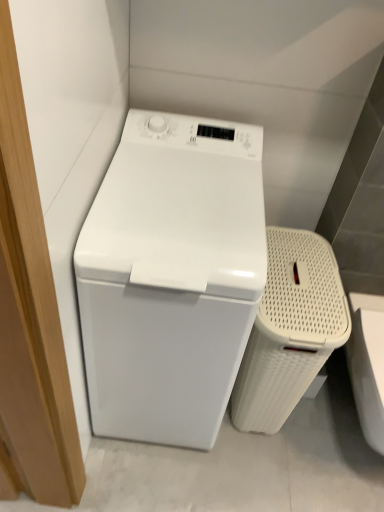
What is the approximate width of white woven laundry basket at right?

white woven laundry basket at right is 17.74 inches wide.

This screenshot has height=512, width=384. Describe the element at coordinates (290, 330) in the screenshot. I see `white woven laundry basket at right` at that location.

Where is `white woven laundry basket at right`? This screenshot has height=512, width=384. white woven laundry basket at right is located at coordinates (290, 330).

In the scene shown: Measure the distance between point [127,204] and camera.

Point [127,204] is 37.40 inches away from camera.

Describe the element at coordinates (171, 277) in the screenshot. I see `white glossy washing machine at left` at that location.

At what (x,y) coordinates should I click in order to perform the action: click on white glossy washing machine at left. Please return your answer as a coordinate pair (x, y). Looking at the image, I should click on click(x=171, y=277).

Identify the location of white woven laundry basket at right. The image size is (384, 512). (290, 330).

Would you say white woven laundry basket at right is to the left or to the right of white glossy washing machine at left in the picture?

Based on their positions, white woven laundry basket at right is located to the right of white glossy washing machine at left.

Between white woven laundry basket at right and white glossy washing machine at left, which one is positioned behind?

Positioned behind is white woven laundry basket at right.

Is point (276, 251) in front of point (99, 349)?

No, it is behind (99, 349).

Consider the image. From the image's perspective, which one is positioned higher, white woven laundry basket at right or white glossy washing machine at left?

white glossy washing machine at left.

From a real-world perspective, is white woven laundry basket at right above or below white glossy washing machine at left?

white woven laundry basket at right is situated lower than white glossy washing machine at left in the real world.

Which object is thinner, white woven laundry basket at right or white glossy washing machine at left?

white woven laundry basket at right is thinner.

Is white woven laundry basket at right taller than white glossy washing machine at left?

In fact, white woven laundry basket at right may be shorter than white glossy washing machine at left.

Can you confirm if white woven laundry basket at right is bigger than white glossy washing machine at left?

Incorrect, white woven laundry basket at right is not larger than white glossy washing machine at left.

Does white woven laundry basket at right contain white glossy washing machine at left?

No, white glossy washing machine at left is not a part of white woven laundry basket at right.

Is white woven laundry basket at right not near white glossy washing machine at left?

No.

Could you tell me if white woven laundry basket at right is facing white glossy washing machine at left?

No, white woven laundry basket at right is not aimed at white glossy washing machine at left.

The height and width of the screenshot is (512, 384). I want to click on washing machine that appears above the white woven laundry basket at right (from a real-world perspective), so click(x=171, y=277).

Is white glossy washing machine at left at the left side of white woven laundry basket at right?

Yes.

Considering the relative positions of white glossy washing machine at left and white woven laundry basket at right in the image provided, is white glossy washing machine at left behind white woven laundry basket at right?

No, white glossy washing machine at left is in front of white woven laundry basket at right.

Does point (150, 345) lie behind point (295, 241)?

No.

From the image's perspective, is white glossy washing machine at left located above or below white woven laundry basket at right?

Clearly, from the image's perspective, white glossy washing machine at left is above white woven laundry basket at right.

From a real-world perspective, who is located higher, white glossy washing machine at left or white woven laundry basket at right?

From a 3D spatial view, white glossy washing machine at left is above.

Is white glossy washing machine at left thinner than white woven laundry basket at right?

Incorrect, the width of white glossy washing machine at left is not less than that of white woven laundry basket at right.

Considering the relative sizes of white glossy washing machine at left and white woven laundry basket at right in the image provided, is white glossy washing machine at left shorter than white woven laundry basket at right?

In fact, white glossy washing machine at left may be taller than white woven laundry basket at right.

Between white glossy washing machine at left and white woven laundry basket at right, which one has larger size?

white glossy washing machine at left.

Can we say white glossy washing machine at left lies outside white woven laundry basket at right?

Indeed, white glossy washing machine at left is completely outside white woven laundry basket at right.

Are white glossy washing machine at left and white woven laundry basket at right making contact?

No.

Is white glossy washing machine at left facing towards white woven laundry basket at right?

No.

In the image, there is a white glossy washing machine at left. Identify the location of laundry basket below it (from the image's perspective). The width and height of the screenshot is (384, 512). (290, 330).

At what (x,y) coordinates should I click in order to perform the action: click on laundry basket that is under the white glossy washing machine at left (from a real-world perspective). Please return your answer as a coordinate pair (x, y). Image resolution: width=384 pixels, height=512 pixels. Looking at the image, I should click on (290, 330).

Find the location of a particular element. washing machine above the white woven laundry basket at right (from a real-world perspective) is located at coordinates tap(171, 277).